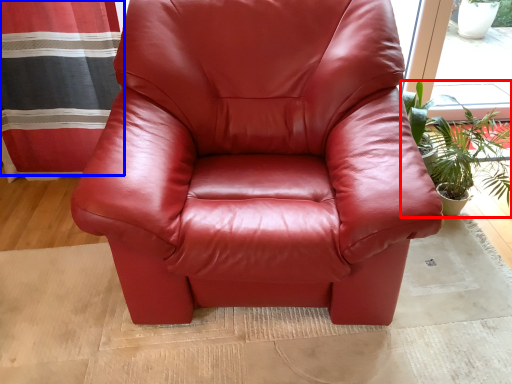
Question: Which of the following is the farthest to the observer, houseplant (highlighted by a red box) or curtain (highlighted by a blue box)?

Choices:
 (A) houseplant
 (B) curtain

Answer: (B)